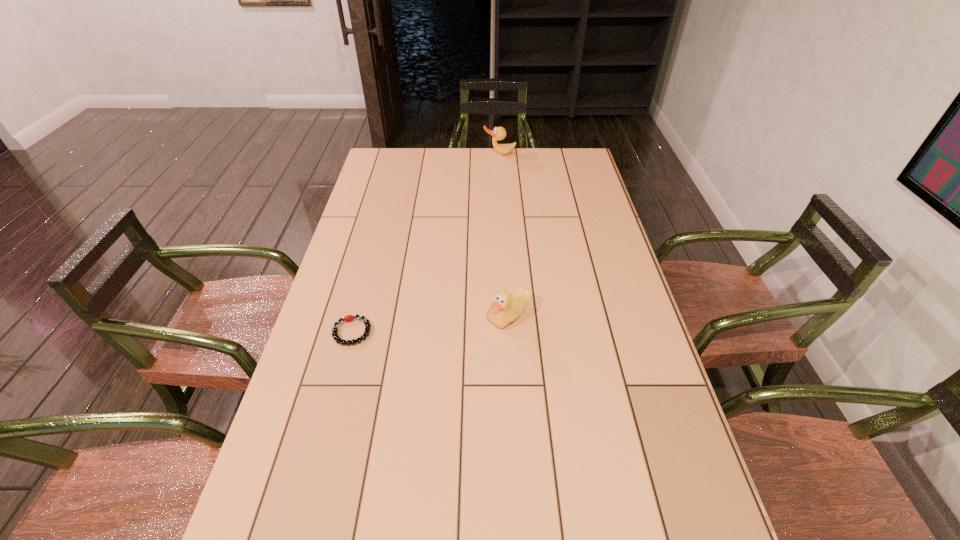
You are a GUI agent. You are given a task and a screenshot of the screen. Output one action in this format:
    pyautogui.click(x=<x>, y=<y>)
    Task: Click on the free space that satisfies the following two spatial constraints: 1. on the beak of the farthest object; 2. at the beak of the nearer duck
    This screenshot has height=540, width=960.
    Given the screenshot: What is the action you would take?
    (510, 316)